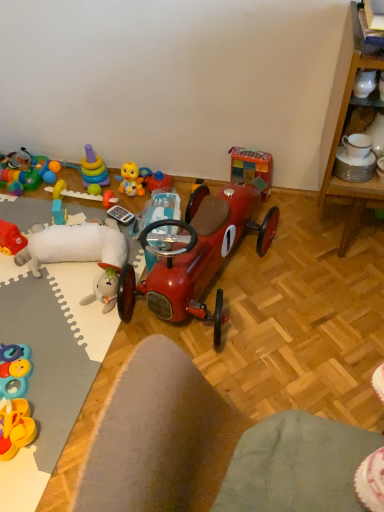
This screenshot has height=512, width=384. Identify the location of vacant area located to the right-hand side of rubberized plastic rings at lower left, which is the 4th toy in left-to-right order. (70, 368).